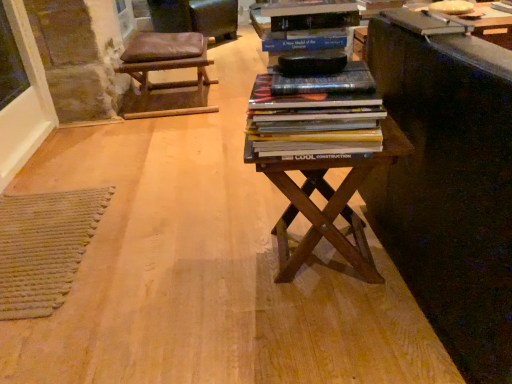
The width and height of the screenshot is (512, 384). Find the location of `free space that is in between brown wooden table at center and brown leather stool at upper left`. free space that is in between brown wooden table at center and brown leather stool at upper left is located at coordinates (201, 157).